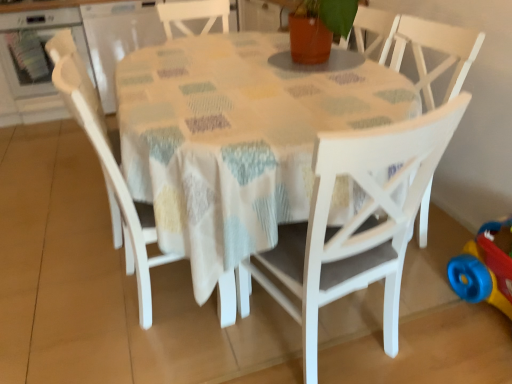
Question: Visually, is white matte chair at center, the 3th chair positioned from the left, positioned to the left or to the right of white wood table at center?

Choices:
 (A) right
 (B) left

Answer: (A)

Question: Is white matte chair at center, the 3th chair positioned from the left, bigger or smaller than white wood table at center?

Choices:
 (A) small
 (B) big

Answer: (A)

Question: Which object is the closest to the white wood table at center?

Choices:
 (A) rubberized plastic toy at lower right
 (B) white matte chair at center, the 3th chair positioned from the left
 (C) matte white chair at left, the 1th chair positioned from the left
 (D) white wood chair at center, which ranks as the second chair in right-to-left order
 (E) transparent plastic container at upper left

Answer: (B)

Question: Estimate the real-world distances between objects in this image. Which object is closer to the rubberized plastic toy at lower right?

Choices:
 (A) white wood chair at center, which is counted as the 2th chair, starting from the left
 (B) brushed metal oven at upper left
 (C) transparent plastic container at upper left
 (D) white wood table at center
 (E) white matte chair at center, the 3th chair positioned from the left

Answer: (E)